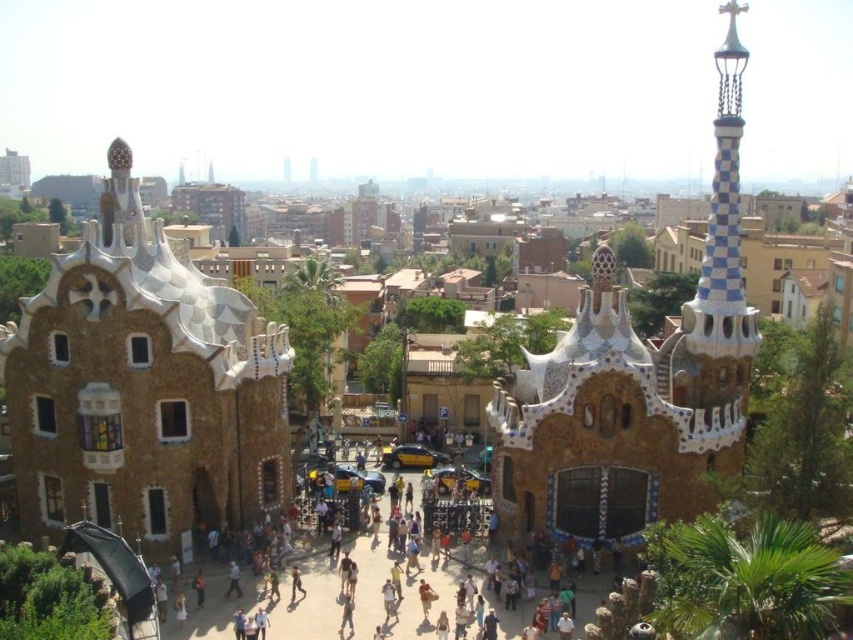
Question: Does blue and white mosaic spire at upper right appear under brown textured stone archway at center?

Choices:
 (A) yes
 (B) no

Answer: (B)

Question: Based on their relative distances, which object is nearer to the blue and white mosaic spire at upper right?

Choices:
 (A) white mosaic building at left
 (B) brown textured stone archway at center

Answer: (B)

Question: Which object appears farthest from the camera in this image?

Choices:
 (A) brown textured stone archway at center
 (B) white mosaic building at left
 (C) blue and white mosaic spire at upper right

Answer: (C)

Question: Does blue and white mosaic spire at upper right have a larger size compared to brown textured stone archway at center?

Choices:
 (A) no
 (B) yes

Answer: (B)

Question: Does white mosaic building at left lie in front of brown textured stone archway at center?

Choices:
 (A) no
 (B) yes

Answer: (A)

Question: Estimate the real-world distances between objects in this image. Which object is closer to the blue and white mosaic spire at upper right?

Choices:
 (A) white mosaic building at left
 (B) brown textured stone archway at center

Answer: (B)